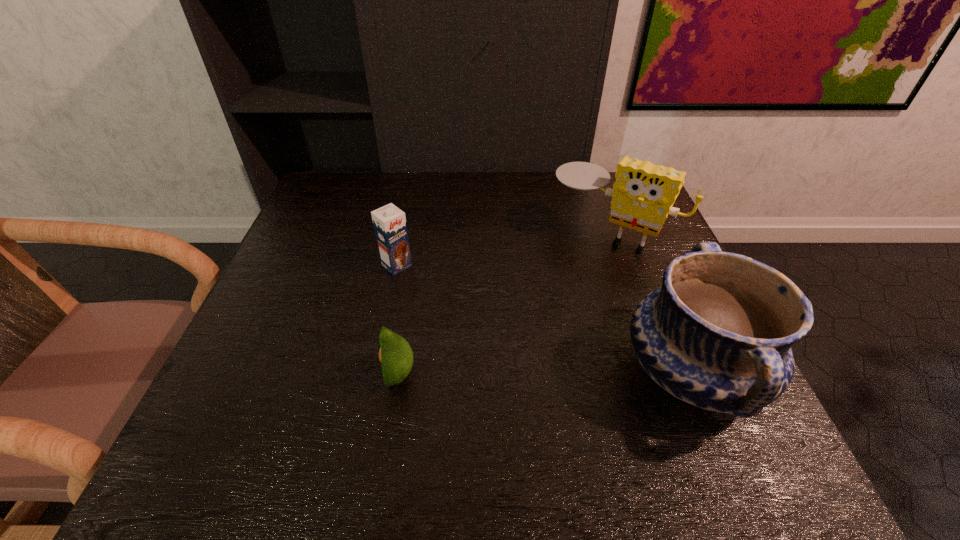
Where is `object at the near right corner`? The image size is (960, 540). object at the near right corner is located at coordinates (718, 334).

The image size is (960, 540). In the image, there is a desktop. What are the coordinates of `vacant space at the far edge` in the screenshot? It's located at (454, 187).

Find the location of `blank space at the near edge of the desktop`. blank space at the near edge of the desktop is located at coordinates (538, 408).

In the image, there is a desktop. Where is `blank space at the left edge`? blank space at the left edge is located at coordinates (298, 297).

This screenshot has width=960, height=540. Identify the location of vacant space at the right edge of the desktop. (634, 295).

At what (x,y) coordinates should I click in order to perform the action: click on vacant region at the far left corner of the desktop. Please return your answer as a coordinate pair (x, y). The height and width of the screenshot is (540, 960). Looking at the image, I should click on (327, 210).

This screenshot has height=540, width=960. Identify the location of free space between the pottery and the avocado. (545, 374).

What are the coordinates of `blank region between the pottery and the third tallest object` in the screenshot? It's located at (544, 319).

Locate an element on the screen. Image resolution: width=960 pixels, height=540 pixels. empty space between the sponge and the avocado is located at coordinates (504, 304).

You are a GUI agent. You are given a task and a screenshot of the screen. Output one action in this format:
    pyautogui.click(x=<x>, y=<y>)
    Task: Click on the empty space that is in between the third tallest object and the sponge
    This screenshot has width=960, height=540.
    Given the screenshot: What is the action you would take?
    pyautogui.click(x=503, y=250)